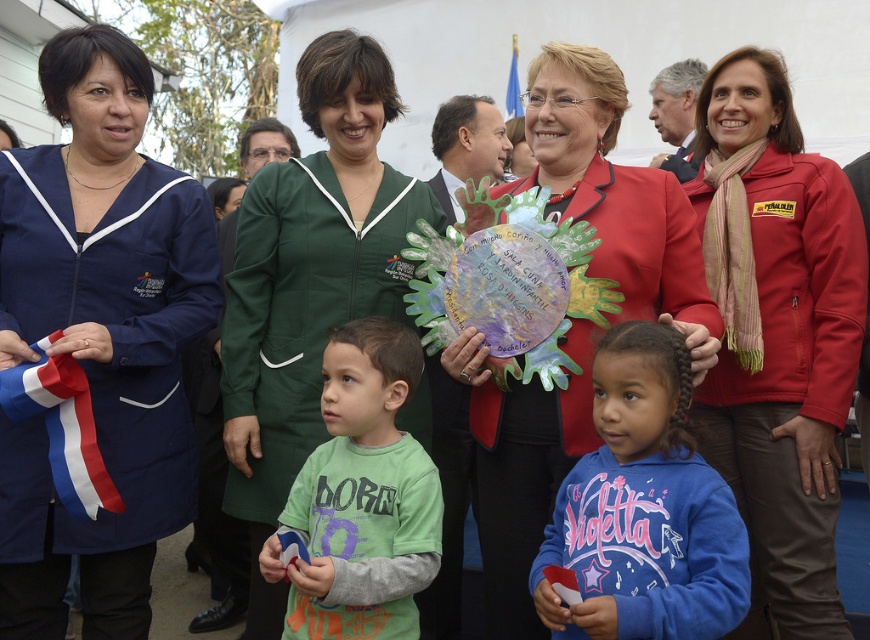
Can you confirm if green fabric at center is bigger than blue fleece sweatshirt at center?

Yes, green fabric at center is bigger than blue fleece sweatshirt at center.

Where is `green fabric at center`? green fabric at center is located at coordinates (309, 284).

Is point (253, 285) positioned in front of point (659, 394)?

That is False.

Image resolution: width=870 pixels, height=640 pixels. In order to click on green fabric at center in this screenshot , I will do `click(309, 284)`.

Consider the image. Which is more to the right, blue fleece sweatshirt at center or green cotton shirt at center?

blue fleece sweatshirt at center

Is blue fleece sweatshirt at center shorter than green cotton shirt at center?

Yes.

Who is more forward, (668,364) or (326,428)?

Point (668,364) is more forward.

Locate an element on the screen. This screenshot has height=640, width=870. blue fleece sweatshirt at center is located at coordinates (644, 508).

In the scene shown: Is red softshell jacket at center below green fabric at center?

No.

Which is in front, point (740, 168) or point (293, 241)?

Point (293, 241) is in front.

Describe the element at coordinates (777, 337) in the screenshot. This screenshot has height=640, width=870. I see `red softshell jacket at center` at that location.

In order to click on red softshell jacket at center in this screenshot , I will do `click(777, 337)`.